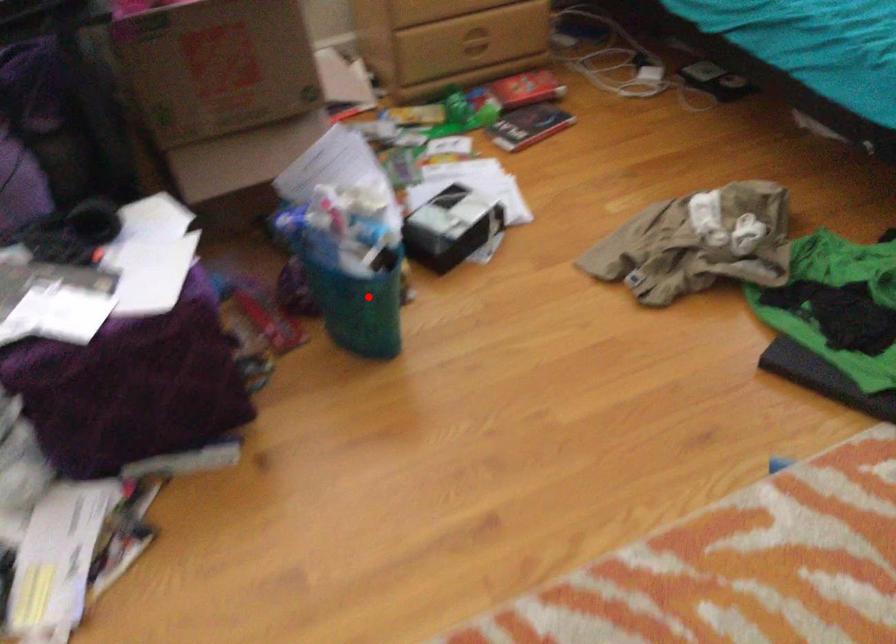
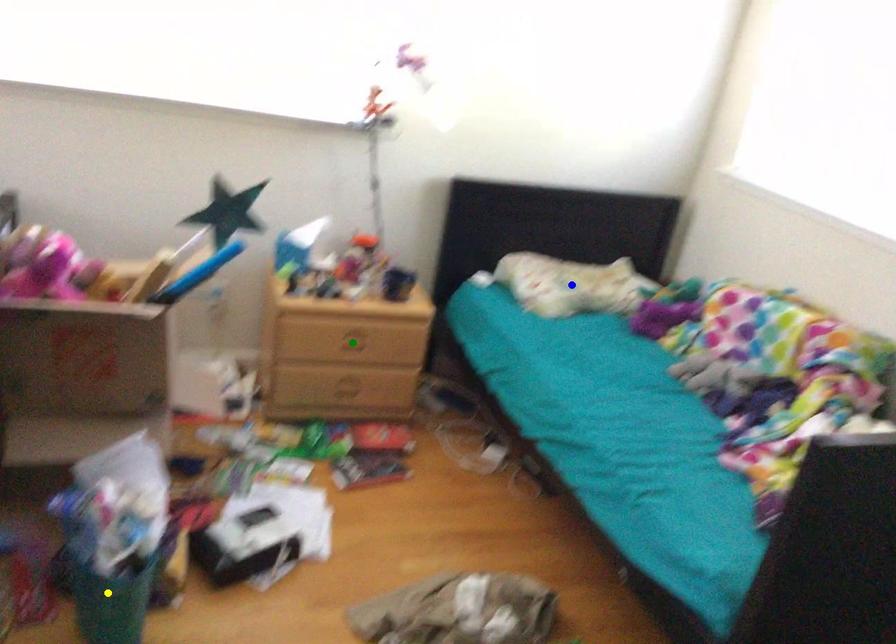
Question: I am providing you with two images of the same scene from different viewpoints. A red point is marked on the first image. You are given multiple points on the second image. Can you choose the point in image 2 that corresponds to the point in image 1?

Choices:
 (A) green point
 (B) blue point
 (C) yellow point

Answer: (C)